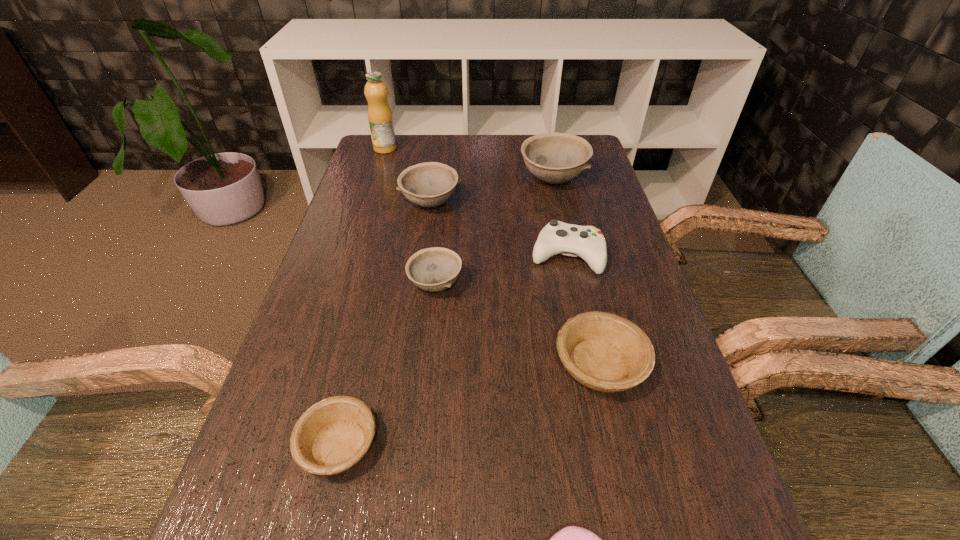
Locate an element on the screen. Image resolution: width=960 pixels, height=540 pixels. fruit juice that is at the far edge is located at coordinates (380, 118).

Identify the location of bowl positioned at the far edge. (555, 158).

The height and width of the screenshot is (540, 960). In order to click on fruit juice that is at the left edge in this screenshot , I will do `click(380, 118)`.

In order to click on control that is positioned at the right edge in this screenshot , I will do point(587,242).

This screenshot has height=540, width=960. Identify the location of object that is at the far left corner. (x=380, y=118).

Image resolution: width=960 pixels, height=540 pixels. In order to click on object situated at the far right corner in this screenshot , I will do `click(555, 158)`.

Locate an element on the screen. vacant space at the far edge is located at coordinates (482, 144).

You are a GUI agent. You are given a task and a screenshot of the screen. Output one action in this format:
    pyautogui.click(x=<x>, y=<y>)
    Task: Click on the free spot at the left edge of the desktop
    
    Given the screenshot: What is the action you would take?
    pyautogui.click(x=352, y=383)

Where is `free space at the right edge of the desktop`? Image resolution: width=960 pixels, height=540 pixels. free space at the right edge of the desktop is located at coordinates (715, 470).

You are a GUI agent. You are given a task and a screenshot of the screen. Output one action in this format:
    pyautogui.click(x=<x>, y=<y>)
    Task: Click on the free space at the far left corner
    
    Given the screenshot: What is the action you would take?
    pyautogui.click(x=374, y=168)